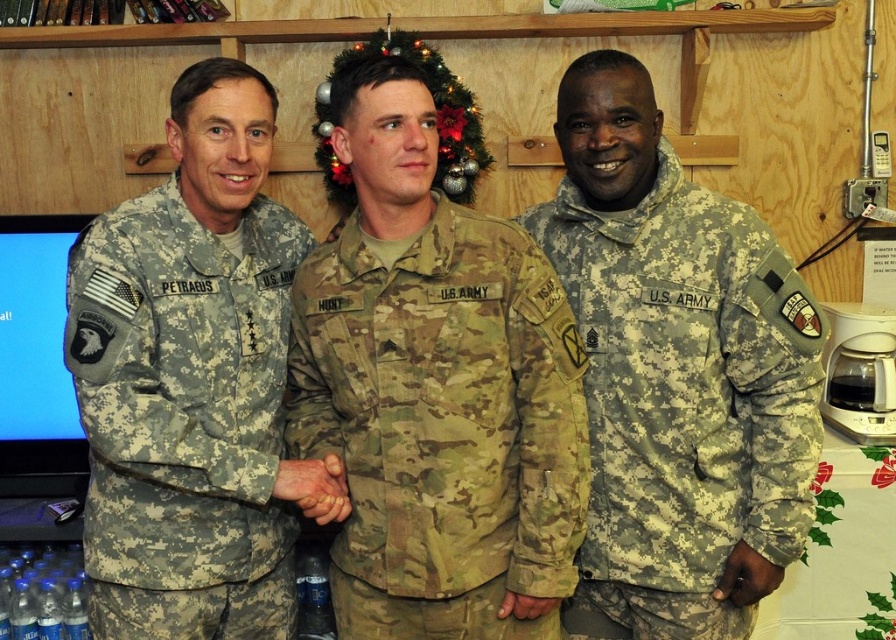
Question: Does camouflage fabric uniform at center have a greater width compared to camouflage fabric uniform at left?

Choices:
 (A) no
 (B) yes

Answer: (B)

Question: Which of the following is the farthest from the observer?

Choices:
 (A) camouflage fabric uniform at center
 (B) camouflage fabric uniform at left
 (C) matte camouflage hand at center

Answer: (C)

Question: Among these points, which one is nearest to the camera?

Choices:
 (A) (362, 627)
 (B) (104, 484)
 (C) (630, 61)

Answer: (A)

Question: Which of the following is the farthest from the observer?

Choices:
 (A) (741, 582)
 (B) (770, 326)

Answer: (A)

Question: Can you confirm if camouflage fabric uniform at left is positioned above matte camouflage hand at center?

Choices:
 (A) no
 (B) yes

Answer: (B)

Question: Considering the relative positions of camouflage fabric uniform at center and matte camouflage hand at center in the image provided, where is camouflage fabric uniform at center located with respect to matte camouflage hand at center?

Choices:
 (A) below
 (B) above

Answer: (B)